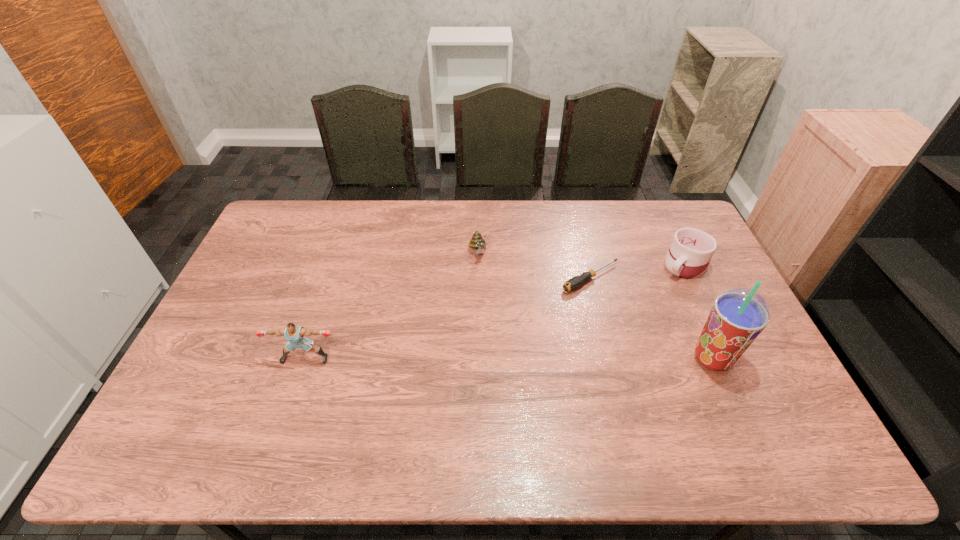
Locate an element on the screen. vacant space on the desktop that is between the leftmost object and the tallest object and is positioned at the tip of the third object from right to left is located at coordinates (449, 359).

The width and height of the screenshot is (960, 540). What are the coordinates of `vacant space on the desktop that is between the leftmost object and the smoothie and is positioned on the face of the second object from left to right` in the screenshot? It's located at (514, 359).

Identify the location of vacant space on the desktop that is between the leftmost object and the smoothie and is positioned on the side with the handle of the mug. (569, 359).